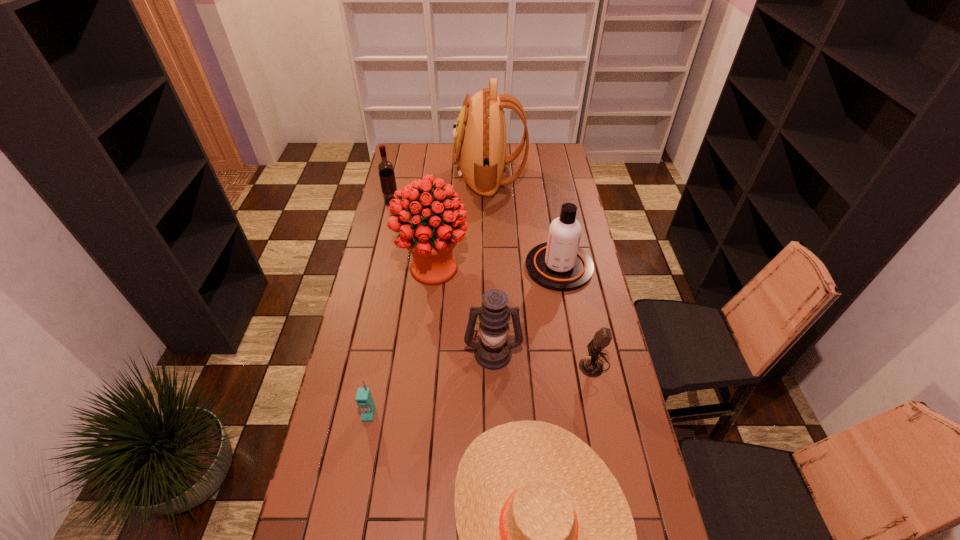
Find the location of a particular element. The height and width of the screenshot is (540, 960). backpack is located at coordinates (479, 152).

The width and height of the screenshot is (960, 540). In order to click on bouquet in this screenshot , I will do `click(431, 238)`.

Locate an element on the screen. The image size is (960, 540). cleansing agent is located at coordinates (559, 264).

Find the location of a particular element. wine bottle is located at coordinates (385, 168).

What are the coordinates of `oil lamp` in the screenshot? It's located at (493, 351).

Where is `microphone`? The width and height of the screenshot is (960, 540). microphone is located at coordinates (591, 366).

At what (x,y) coordinates should I click in order to perform the action: click on the second nearest object. Please return your answer as a coordinate pair (x, y). The width and height of the screenshot is (960, 540). Looking at the image, I should click on (364, 399).

You are a GUI agent. You are given a task and a screenshot of the screen. Output one action in this format:
    pyautogui.click(x=<x>, y=<y>)
    Task: Click on the vacant space located 0.100m on the front-facing side of the backpack
    This screenshot has width=960, height=540.
    Given the screenshot: What is the action you would take?
    pyautogui.click(x=434, y=176)

Where is `free space located on the front-facing side of the backpack`? free space located on the front-facing side of the backpack is located at coordinates (421, 176).

Where is `vacant space located 0.140m on the front-facing side of the backpack`? This screenshot has width=960, height=540. vacant space located 0.140m on the front-facing side of the backpack is located at coordinates (425, 176).